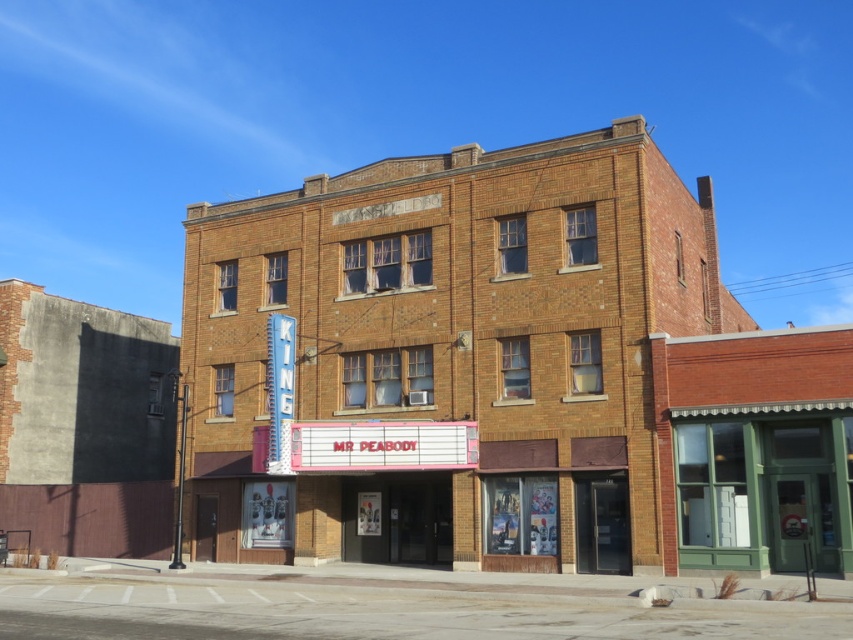
Is brown brick theater at center below green painted wood storefront at center?

No, brown brick theater at center is not below green painted wood storefront at center.

Is brown brick theater at center shorter than green painted wood storefront at center?

Incorrect, brown brick theater at center's height does not fall short of green painted wood storefront at center's.

Between point (369, 486) and point (834, 464), which one is positioned behind?

Point (369, 486)

This screenshot has height=640, width=853. Identify the location of brown brick theater at center. (503, 374).